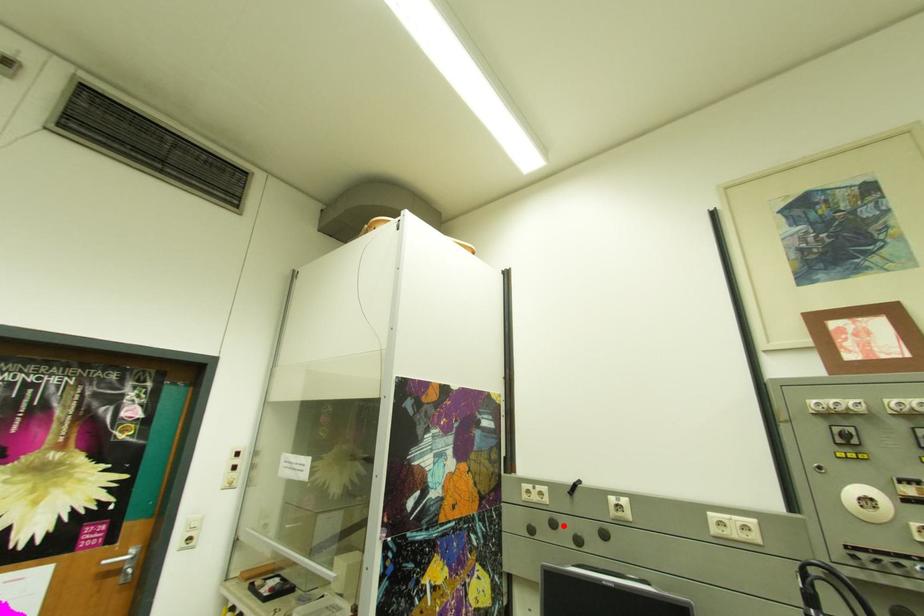
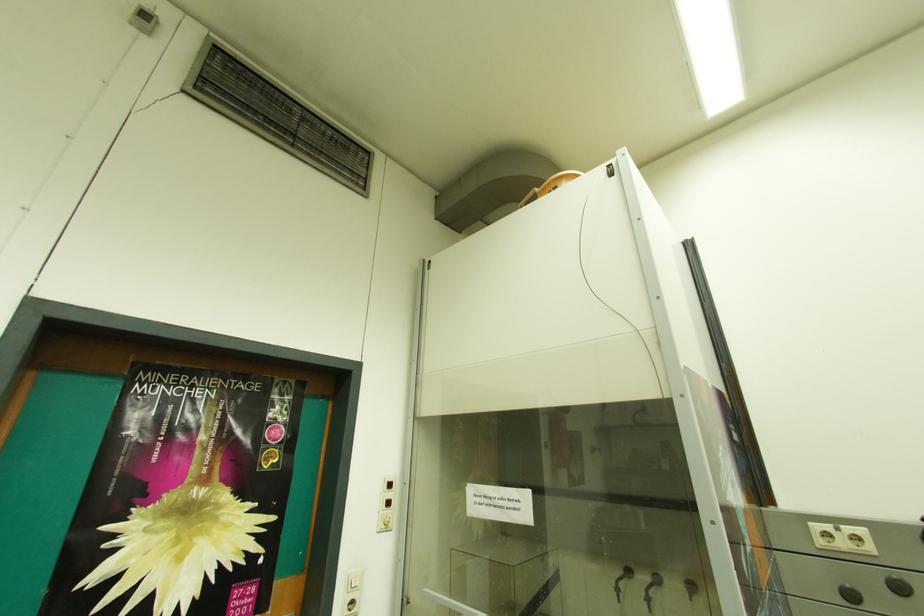
Locate, in the second image, the point that corresponds to the highlighted location in the first image.

(910, 590)